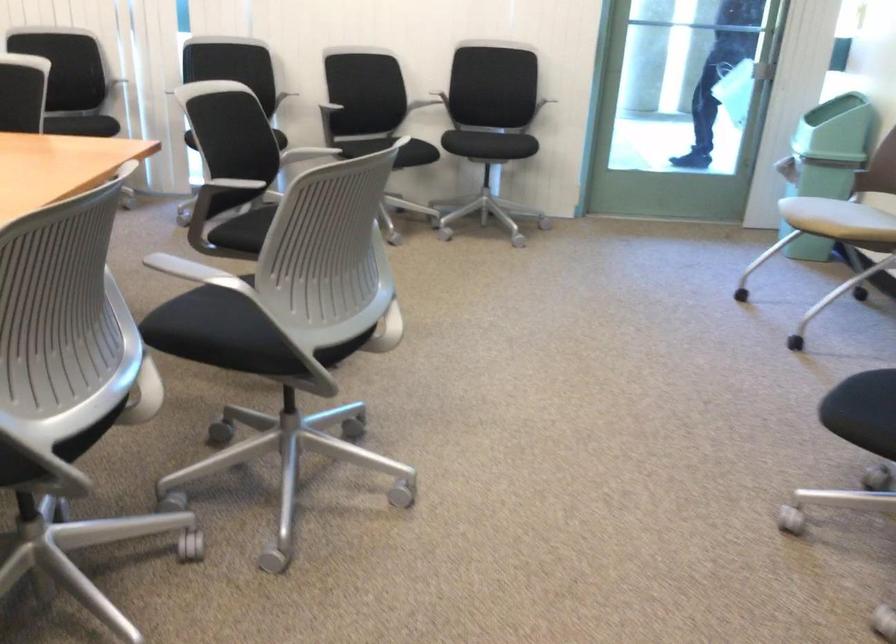
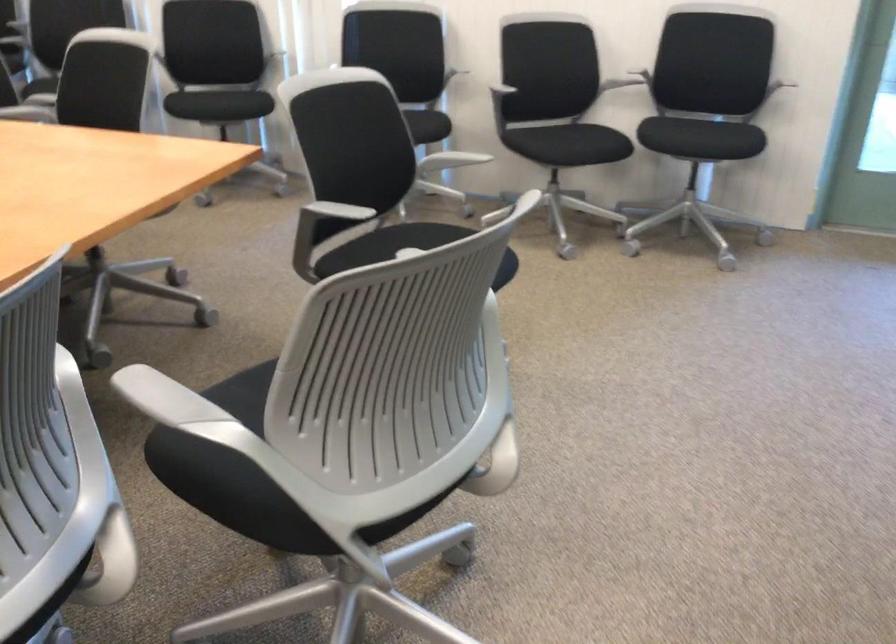
Question: What movement of the cameraman would produce the second image?

Choices:
 (A) Left
 (B) Right
 (C) Forward
 (D) Backward

Answer: (C)